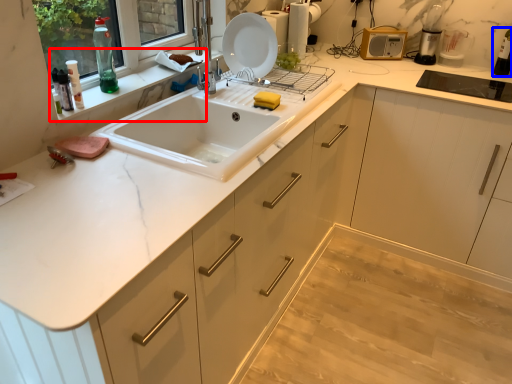
Question: Which point is closer to the camera, window sill (highlighted by a red box) or bottle (highlighted by a blue box)?

Choices:
 (A) window sill
 (B) bottle

Answer: (A)